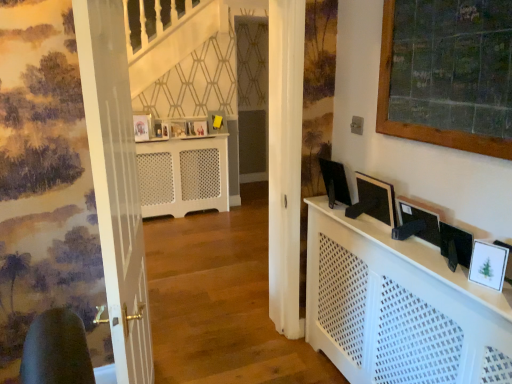
Find the location of a particular element. The height and width of the screenshot is (384, 512). free space in front of matte black monitor at right, which is the first computer monitor from front to back is located at coordinates coord(472,286).